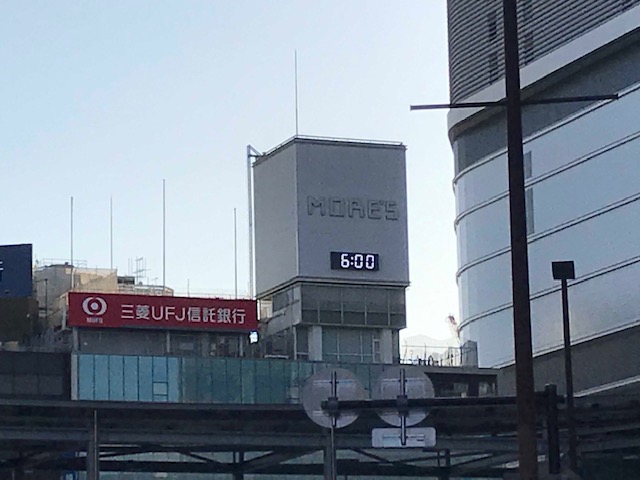
At what (x,y) coordinates should I click in order to perform the action: click on windows. Please return your answer as a coordinate pair (x, y). Looking at the image, I should click on (580, 222).